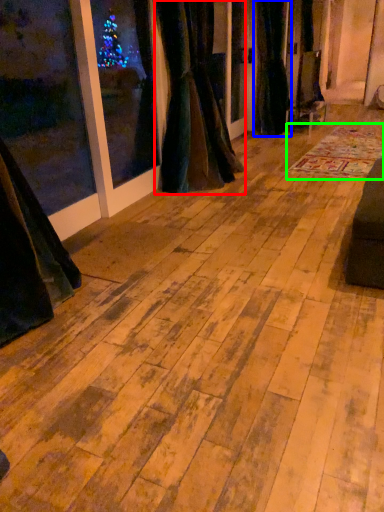
Question: Which is farther away from curtain (highlighted by a red box)? curtain (highlighted by a blue box) or mat (highlighted by a green box)?

Choices:
 (A) curtain
 (B) mat

Answer: (A)